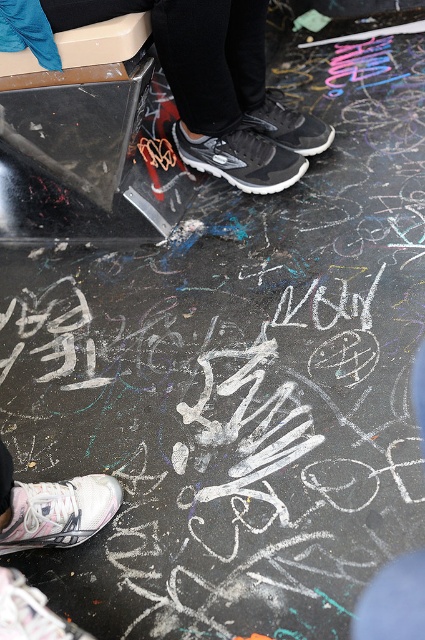
Who is higher up, black mesh running shoe at center or matte black sneaker at center?

matte black sneaker at center is higher up.

Is point (180, 147) positioned before point (255, 125)?

No.

Is point (246, 173) closer to camera compared to point (266, 104)?

Yes, it is in front of point (266, 104).

Where is `black mesh running shoe at center`? Image resolution: width=425 pixels, height=640 pixels. black mesh running shoe at center is located at coordinates (240, 157).

Is black mesh running shoe at center to the right of white mesh sneaker at lower left from the viewer's perspective?

Indeed, black mesh running shoe at center is positioned on the right side of white mesh sneaker at lower left.

Is point (252, 132) positioned before point (79, 634)?

No, it is behind (79, 634).

Is point (263, 189) more distant than point (10, 577)?

Yes, it is behind point (10, 577).

Identify the location of black mesh running shoe at center. (240, 157).

Does white mesh shoe at lower left appear over matte black sneaker at center?

No, white mesh shoe at lower left is not above matte black sneaker at center.

Does point (70, 516) come farther from viewer compared to point (299, 132)?

That is False.

Which is in front, point (2, 548) or point (306, 140)?

Point (2, 548) is in front.

Identify the location of white mesh shoe at lower left. (59, 512).